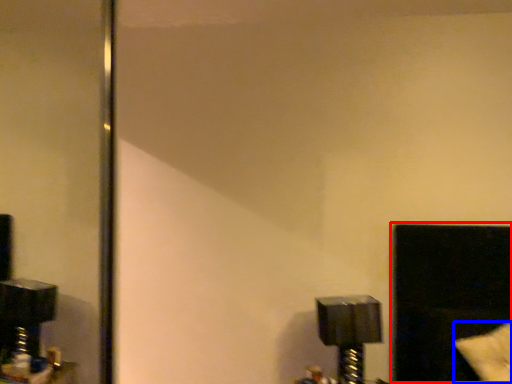
Question: Among these objects, which one is nearest to the camera, window (highlighted by a red box) or pillow (highlighted by a blue box)?

Choices:
 (A) window
 (B) pillow

Answer: (B)